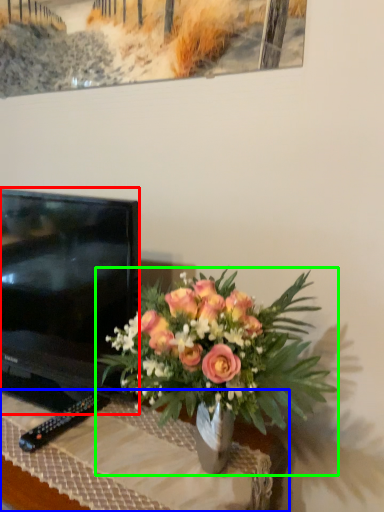
Question: Estimate the real-world distances between objects in this image. Which object is farther from television (highlighted by a red box), desk (highlighted by a blue box) or houseplant (highlighted by a green box)?

Choices:
 (A) desk
 (B) houseplant

Answer: (B)